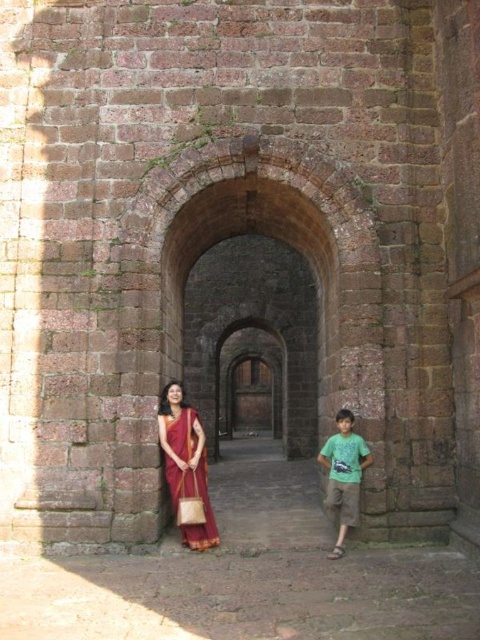
You are a fashion designer observing the historical archway scene. You notice two people wearing different outfits. The first person is wearing a maroon silk saree at center, and the second is wearing a green cotton shirt at lower right. Which outfit is shorter in length?

The maroon silk saree at center is shorter than the green cotton shirt at lower right, so the maroon silk saree at center is the shorter outfit.

You are a photographer positioned at the entrance of the archway. You want to capture a photo that includes the maroon silk saree at center. Based on the coordinates provided, where should you aim your camera to ensure the saree is centered in the frame?

To center the maroon silk saree at center in the frame, aim your camera at the coordinates point (186, 464) provided in the description.

You are an artist planning to sketch this scene. You want to ensure the sizes of the maroon silk saree at center and the green cotton shirt at lower right are proportionally accurate. Which one should you draw larger?

The green cotton shirt at lower right should be drawn larger because the maroon silk saree at center is smaller than the green cotton shirt at lower right.